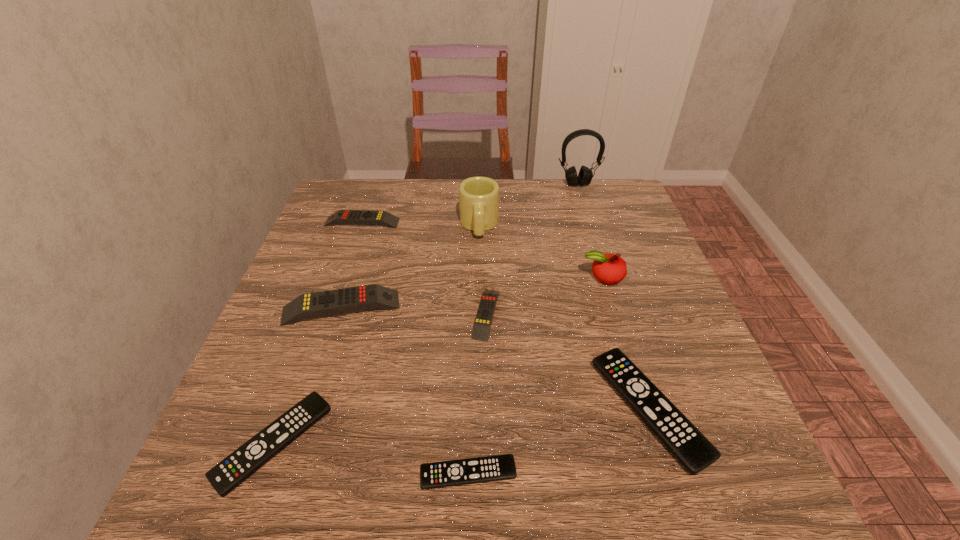
You are a GUI agent. You are given a task and a screenshot of the screen. Output one action in this format:
    pyautogui.click(x=<x>, y=<y>)
    Task: Click on the vacant space at the near right corner of the desktop
    This screenshot has width=960, height=540.
    Given the screenshot: What is the action you would take?
    pyautogui.click(x=683, y=502)

You are a GUI agent. You are given a task and a screenshot of the screen. Output one action in this format:
    pyautogui.click(x=<x>, y=<y>)
    Task: Click on the vacant space that's between the second smallest yellow remote control and the red apple
    The image size is (960, 540).
    Given the screenshot: What is the action you would take?
    pyautogui.click(x=482, y=249)

The width and height of the screenshot is (960, 540). In order to click on free point between the second smallest yellow remote control and the second smallest black remote control in this screenshot , I will do `click(318, 333)`.

Identify the location of free space that is in between the smallest yellow remote control and the second smallest black remote control. (380, 379).

Locate an element on the screen. This screenshot has width=960, height=540. empty space that is in between the second biggest yellow remote control and the red apple is located at coordinates (482, 249).

Identify the location of vacant space in between the apple and the shortest object. (536, 375).

Image resolution: width=960 pixels, height=540 pixels. What are the coordinates of `vacant area that lies between the mug and the biggest black remote control` in the screenshot? It's located at (564, 318).

Where is `free space between the tallest object and the tallest remote control`? The image size is (960, 540). free space between the tallest object and the tallest remote control is located at coordinates point(460,246).

Find the location of `vacant space in between the second tallest object and the headset`. vacant space in between the second tallest object and the headset is located at coordinates (528, 205).

Where is `empty space between the farthest remote control and the mug`? This screenshot has width=960, height=540. empty space between the farthest remote control and the mug is located at coordinates (420, 224).